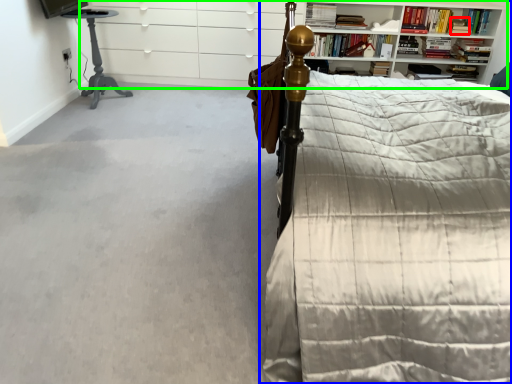
Question: Considering the real-world distances, which object is farthest from book (highlighted by a red box)? bed (highlighted by a blue box) or entertainment center (highlighted by a green box)?

Choices:
 (A) bed
 (B) entertainment center

Answer: (A)